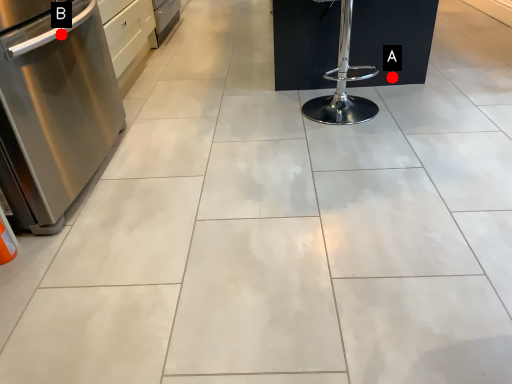
Question: Two points are circled on the image, labeled by A and B beside each circle. Which of the following is the closest to the observer?

Choices:
 (A) A is closer
 (B) B is closer

Answer: (B)